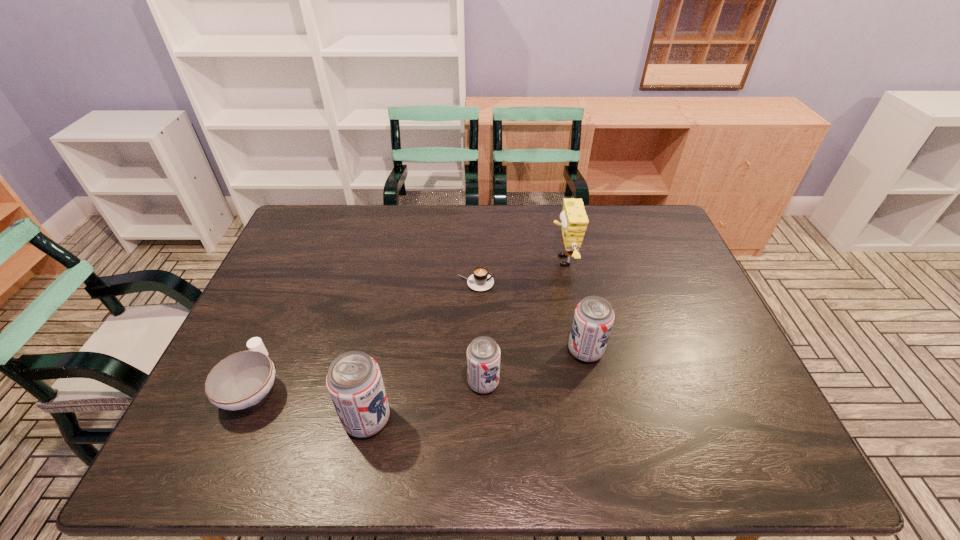
You are a GUI agent. You are given a task and a screenshot of the screen. Output one action in this format:
    pyautogui.click(x=<x>, y=<y>)
    Task: Click on the object that is at the far edge
    The width and height of the screenshot is (960, 540).
    Given the screenshot: What is the action you would take?
    pyautogui.click(x=574, y=220)

Image resolution: width=960 pixels, height=540 pixels. In order to click on chinaware present at the near edge in this screenshot , I will do coord(241,380).

Locate an element on the screen. object located in the left edge section of the desktop is located at coordinates (241, 380).

Find the location of a particular element. object present at the near left corner is located at coordinates (241, 380).

You are a GUI agent. You are given a task and a screenshot of the screen. Output one action in this format:
    pyautogui.click(x=<x>, y=<y>)
    Task: Click on the vacant area at the far edge of the desktop
    The image size is (960, 540).
    Given the screenshot: What is the action you would take?
    pyautogui.click(x=421, y=229)

Find the location of a particular element. The image size is (960, 540). vacant space at the near edge is located at coordinates (634, 415).

This screenshot has height=540, width=960. In the image, there is a desktop. Find the location of `vacant space at the left edge`. vacant space at the left edge is located at coordinates (300, 266).

This screenshot has width=960, height=540. In the image, there is a desktop. Identify the location of vacant space at the right edge. (667, 248).

I want to click on vacant space at the far left corner of the desktop, so click(300, 240).

Find the location of `free spot between the leftmost beer can and the fourth tallest object`. free spot between the leftmost beer can and the fourth tallest object is located at coordinates (425, 401).